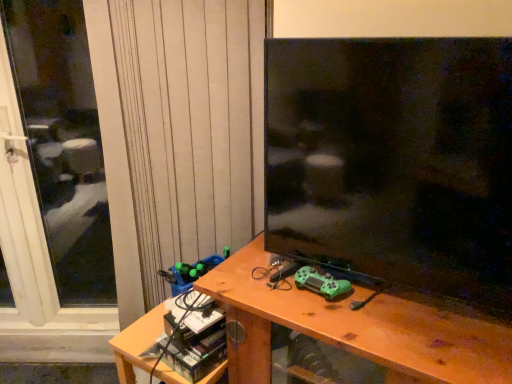
How much space does green matte game controller at center, positioned as the 2th toy in back-to-front order, occupy vertically?

6.25 centimeters.

The image size is (512, 384). What do you see at coordinates (65, 163) in the screenshot?
I see `transparent glass screen door at left` at bounding box center [65, 163].

What is the approximate height of wooden desk at center?

72.09 centimeters.

What do you see at coordinates (137, 344) in the screenshot? The height and width of the screenshot is (384, 512). I see `wooden table at center` at bounding box center [137, 344].

What do you see at coordinates (190, 272) in the screenshot? The width and height of the screenshot is (512, 384). I see `green plastic toy at lower left, which ranks as the first toy in left-to-right order` at bounding box center [190, 272].

Where is `matte black tv at center`? The height and width of the screenshot is (384, 512). matte black tv at center is located at coordinates (394, 162).

In terms of width, does wooden desk at center look wider or thinner when compared to transparent glass screen door at left?

wooden desk at center is wider than transparent glass screen door at left.

From the image's perspective, is wooden desk at center on transparent glass screen door at left?

No.

How much distance is there between wooden desk at center and transparent glass screen door at left?

wooden desk at center is 7.45 feet away from transparent glass screen door at left.

Does wooden desk at center appear on the right side of transparent glass screen door at left?

Correct, you'll find wooden desk at center to the right of transparent glass screen door at left.

Looking at the image, does wooden table at center seem bigger or smaller compared to transparent glass screen door at left?

Clearly, wooden table at center is smaller in size than transparent glass screen door at left.

In the scene shown: Is wooden table at center looking in the opposite direction of transparent glass screen door at left?

wooden table at center does not have its back to transparent glass screen door at left.

Is wooden table at center in front of or behind transparent glass screen door at left in the image?

wooden table at center is in front of transparent glass screen door at left.

Would you say wooden table at center is to the left or to the right of transparent glass screen door at left in the picture?

From the image, it's evident that wooden table at center is to the right of transparent glass screen door at left.

Which toy is the 2nd one when counting from the left side of the matte black tv at center? Please provide its 2D coordinates.

[(190, 272)]

From a real-world perspective, is matte black tv at center above or below green plastic toy at lower left, which ranks as the first toy in left-to-right order?

matte black tv at center is situated higher than green plastic toy at lower left, which ranks as the first toy in left-to-right order, in the real world.

Which is more to the right, matte black tv at center or green plastic toy at lower left, which ranks as the first toy in left-to-right order?

matte black tv at center is more to the right.

Between transparent glass screen door at left and green matte game controller at center, which is the first toy from right to left, which one is positioned behind?

transparent glass screen door at left is behind.

Is transparent glass screen door at left outside of green matte game controller at center, which is the first toy from right to left?

Yes, transparent glass screen door at left is located beyond the bounds of green matte game controller at center, which is the first toy from right to left.

Is transparent glass screen door at left oriented towards green matte game controller at center, positioned as the 2th toy in back-to-front order?

No, transparent glass screen door at left is not turned towards green matte game controller at center, positioned as the 2th toy in back-to-front order.

Does point (211, 265) appear closer or farther from the camera than point (358, 349)?

Point (211, 265).

Is green plastic toy at lower left, the second toy viewed from the right, completely or partially outside of wooden desk at center?

green plastic toy at lower left, the second toy viewed from the right, lies outside wooden desk at center's area.

Is green plastic toy at lower left, the second toy viewed from the right, bigger or smaller than wooden desk at center?

green plastic toy at lower left, the second toy viewed from the right, is smaller than wooden desk at center.

Is green plastic toy at lower left, the 2th toy when ordered from front to back, aimed at wooden desk at center?

No, green plastic toy at lower left, the 2th toy when ordered from front to back, is not facing towards wooden desk at center.

Considering the relative sizes of white textured curtain at upper left and green matte game controller at center, which appears as the 1th toy when viewed from the front, in the image provided, is white textured curtain at upper left wider than green matte game controller at center, which appears as the 1th toy when viewed from the front,?

No.

Identify the location of curtain that appears behind the green matte game controller at center, the second toy in the left-to-right sequence. (190, 125).

From the image's perspective, is white textured curtain at upper left located beneath green matte game controller at center, positioned as the 2th toy in back-to-front order?

Incorrect, from the image's perspective, white textured curtain at upper left is higher than green matte game controller at center, positioned as the 2th toy in back-to-front order.

Are transparent glass screen door at left and wooden table at center located far from each other?

Yes, transparent glass screen door at left and wooden table at center are quite far apart.

Is transparent glass screen door at left taller than wooden table at center?

Indeed, transparent glass screen door at left has a greater height compared to wooden table at center.

Which object is more forward, transparent glass screen door at left or wooden table at center?

Positioned in front is wooden table at center.

Do you think transparent glass screen door at left is within wooden table at center, or outside of it?

transparent glass screen door at left is located beyond the bounds of wooden table at center.

Find the location of a particular element. The width and height of the screenshot is (512, 384). screen door that is on the left side of wooden desk at center is located at coordinates (65, 163).

The width and height of the screenshot is (512, 384). What are the coordinates of `screen door behind the wooden table at center` in the screenshot? It's located at (65, 163).

When comparing their distances from transparent glass screen door at left, does white textured curtain at upper left or green matte game controller at center, which appears as the 1th toy when viewed from the front, seem closer?

white textured curtain at upper left is positioned closer to the anchor transparent glass screen door at left.

Looking at the image, which one is located further to green plastic toy at lower left, arranged as the first toy when viewed from the back, green matte game controller at center, which appears as the 1th toy when viewed from the front, or transparent glass screen door at left?

transparent glass screen door at left is further to green plastic toy at lower left, arranged as the first toy when viewed from the back.

Which object lies nearer to the anchor point matte black tv at center, wooden table at center or white textured curtain at upper left?

Based on the image, white textured curtain at upper left appears to be nearer to matte black tv at center.

Based on their spatial positions, is green plastic toy at lower left, the 2th toy when ordered from front to back, or wooden table at center closer to green matte game controller at center, positioned as the 2th toy in back-to-front order?

green plastic toy at lower left, the 2th toy when ordered from front to back.

Estimate the real-world distances between objects in this image. Which object is further from wooden desk at center, matte black tv at center or white textured curtain at upper left?

Among the two, white textured curtain at upper left is located further to wooden desk at center.

From the image, which object appears to be nearer to wooden table at center, green matte game controller at center, which is the first toy from right to left, or white textured curtain at upper left?

Among the two, green matte game controller at center, which is the first toy from right to left, is located nearer to wooden table at center.

Estimate the real-world distances between objects in this image. Which object is closer to wooden desk at center, wooden table at center or white textured curtain at upper left?

wooden table at center lies closer to wooden desk at center than the other object.

From the image, which object appears to be nearer to green plastic toy at lower left, the 2th toy when ordered from front to back, green matte game controller at center, positioned as the 2th toy in back-to-front order, or matte black tv at center?

green matte game controller at center, positioned as the 2th toy in back-to-front order, is closer to green plastic toy at lower left, the 2th toy when ordered from front to back.

Locate an element on the screen. Image resolution: width=512 pixels, height=384 pixels. curtain situated between transparent glass screen door at left and matte black tv at center from left to right is located at coordinates coord(190,125).

Locate an element on the screen. The height and width of the screenshot is (384, 512). curtain located between transparent glass screen door at left and wooden desk at center in the left-right direction is located at coordinates (190, 125).

At what (x,y) coordinates should I click in order to perform the action: click on toy between matte black tv at center and green plastic toy at lower left, arranged as the first toy when viewed from the back, in the front-back direction. Please return your answer as a coordinate pair (x, y). Looking at the image, I should click on (321, 283).

The height and width of the screenshot is (384, 512). I want to click on curtain located between transparent glass screen door at left and green plastic toy at lower left, the second toy viewed from the right, in the left-right direction, so click(x=190, y=125).